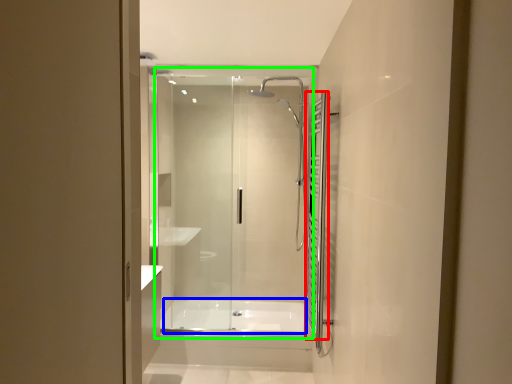
Question: Which object is the farthest from shower curtain (highlighted by a red box)? Choose among these: bath (highlighted by a blue box) or glass door (highlighted by a green box).

Choices:
 (A) bath
 (B) glass door

Answer: (A)